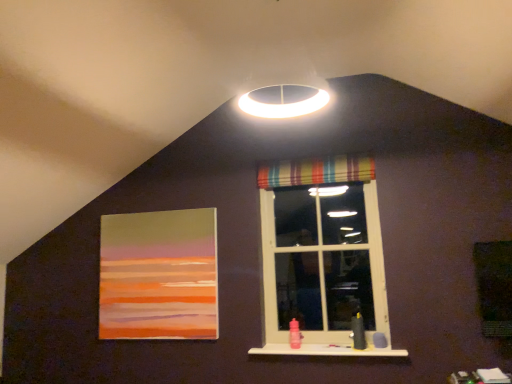
Locate an element on the screen. empty space that is ontop of matte acrylic painting at left (from a real-world perspective) is located at coordinates (157, 208).